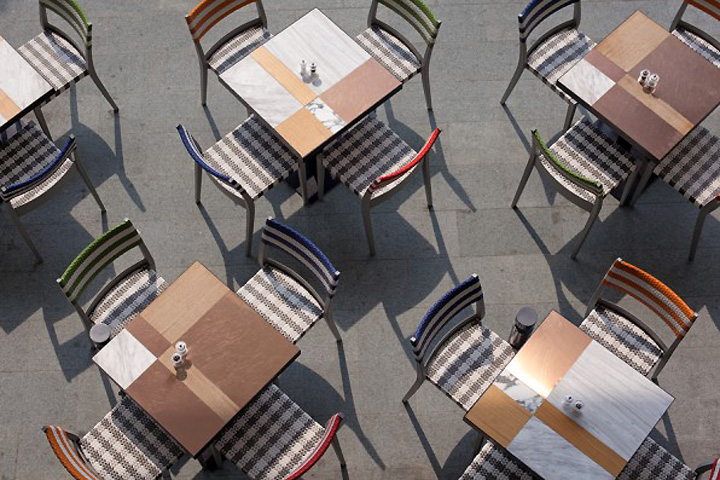
This screenshot has height=480, width=720. I want to click on wooden tables, so (x=29, y=97), (x=279, y=98), (x=623, y=91), (x=605, y=361), (x=252, y=332).